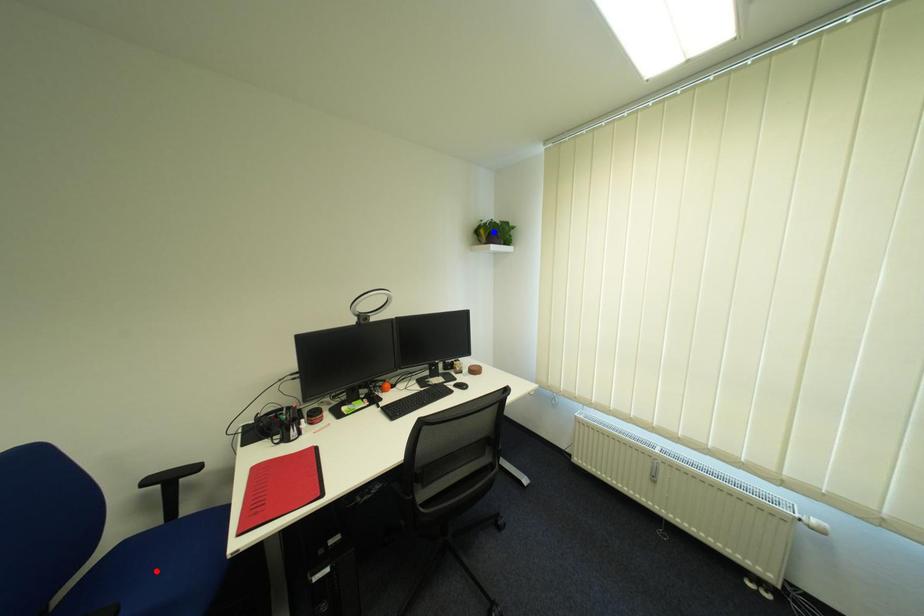
Question: Which of the two points in the image is closer to the camera?

Choices:
 (A) Blue point is closer.
 (B) Red point is closer.

Answer: (B)